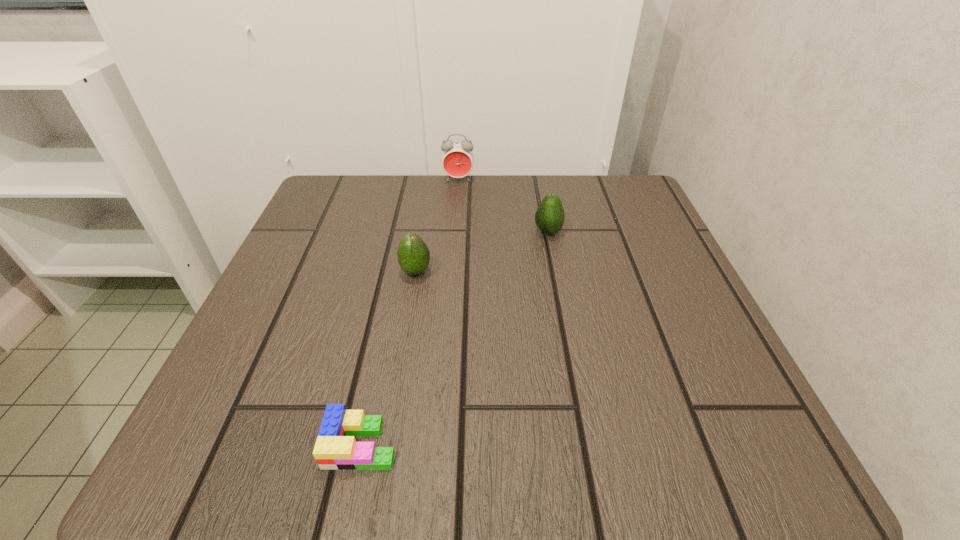
Locate an element on the screen. the farthest object is located at coordinates (457, 158).

The image size is (960, 540). What are the coordinates of `alarm clock` in the screenshot? It's located at (457, 158).

Where is `the rightmost object`? The height and width of the screenshot is (540, 960). the rightmost object is located at coordinates point(549,217).

Find the location of `the right avocado`. the right avocado is located at coordinates (549, 217).

Find the location of a particular element. This screenshot has width=960, height=540. the nearer avocado is located at coordinates (413, 254).

Where is `the left avocado`? The image size is (960, 540). the left avocado is located at coordinates (413, 254).

The height and width of the screenshot is (540, 960). Find the location of `the shortest object`. the shortest object is located at coordinates (336, 448).

Find the location of a particular element. This screenshot has height=540, width=960. the nearest object is located at coordinates (336, 448).

In order to click on vacant position located 0.160m on the face of the tallest object in this screenshot , I will do `click(455, 224)`.

At what (x,y) coordinates should I click in order to perform the action: click on blank space located 0.210m on the front of the right avocado. Please return your answer as a coordinate pair (x, y). This screenshot has height=540, width=960. Looking at the image, I should click on [x=564, y=319].